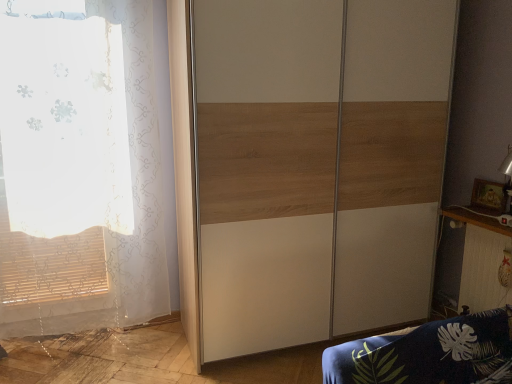
Image resolution: width=512 pixels, height=384 pixels. Describe the element at coordinates (133, 205) in the screenshot. I see `white sheer curtain at left` at that location.

Locate an element on the screen. This screenshot has width=512, height=384. white sheer curtain at left is located at coordinates (133, 205).

Which object is positioned more to the left, wooden/textured wardrobe at center or white sheer curtain at left?

white sheer curtain at left.

Is the position of wooden/textured wardrobe at center more distant than that of white sheer curtain at left?

No, wooden/textured wardrobe at center is closer to the camera.

Based on the photo, can you confirm if wooden/textured wardrobe at center is taller than white sheer curtain at left?

Indeed, wooden/textured wardrobe at center has a greater height compared to white sheer curtain at left.

From the image's perspective, is wooden/textured wardrobe at center beneath white sheer curtain at left?

Actually, wooden/textured wardrobe at center appears above white sheer curtain at left in the image.

Is wooden table at right beside wooden/textured wardrobe at center?

No, wooden table at right is not beside wooden/textured wardrobe at center.

Which object is thinner, wooden table at right or wooden/textured wardrobe at center?

wooden table at right.

Looking at this image, which object is closer to the camera taking this photo, wooden table at right or wooden/textured wardrobe at center?

wooden/textured wardrobe at center is in front.

Looking at this image, from the image's perspective, is white sheer curtain at left under wooden/textured wardrobe at center?

Yes.

Choose the correct answer: Is white sheer curtain at left inside wooden/textured wardrobe at center or outside it?

white sheer curtain at left is spatially situated outside wooden/textured wardrobe at center.

From a real-world perspective, which object rests below the other?

From a 3D spatial view, white sheer curtain at left is below.

Which is more to the right, white sheer curtain at left or wooden/textured wardrobe at center?

wooden/textured wardrobe at center is more to the right.

Can you confirm if wooden table at right is positioned to the left of white sheer curtain at left?

Incorrect, wooden table at right is not on the left side of white sheer curtain at left.

Which point is more distant from viewer, (510, 247) or (151, 140)?

The point (151, 140) is farther.

Who is smaller, wooden table at right or white sheer curtain at left?

Smaller between the two is wooden table at right.

The width and height of the screenshot is (512, 384). In the image, there is a white sheer curtain at left. In order to click on table below it (from a real-world perspective) in this screenshot , I will do `click(482, 260)`.

How different are the orientations of wooden/textured wardrobe at center and wooden table at right in degrees?

There is a 90.1-degree angle between the facing directions of wooden/textured wardrobe at center and wooden table at right.

Is wooden/textured wardrobe at center beside wooden table at right?

There is a gap between wooden/textured wardrobe at center and wooden table at right.

Considering the relative sizes of wooden/textured wardrobe at center and wooden table at right in the image provided, is wooden/textured wardrobe at center bigger than wooden table at right?

Correct, wooden/textured wardrobe at center is larger in size than wooden table at right.

From the image's perspective, between white sheer curtain at left and wooden table at right, who is located below?

From the image's view, wooden table at right is below.

Is white sheer curtain at left touching wooden table at right?

There is a gap between white sheer curtain at left and wooden table at right.

Based on the photo, is white sheer curtain at left facing towards wooden table at right?

No, white sheer curtain at left does not turn towards wooden table at right.

Find the location of `curtain below the wooden/textured wardrobe at center (from the image's perspective)`. curtain below the wooden/textured wardrobe at center (from the image's perspective) is located at coordinates (133, 205).

This screenshot has width=512, height=384. What are the coordinates of `screen door above the wooden table at right (from the image's perspective)` in the screenshot? It's located at (318, 165).

Estimate the real-world distances between objects in this image. Which object is closer to white sheer curtain at left, wooden/textured wardrobe at center or wooden table at right?

Based on the image, wooden/textured wardrobe at center appears to be nearer to white sheer curtain at left.

Looking at the image, which one is located further to wooden table at right, white sheer curtain at left or wooden/textured wardrobe at center?

white sheer curtain at left is positioned further to the anchor wooden table at right.

Consider the image. Estimate the real-world distances between objects in this image. Which object is closer to wooden table at right, wooden/textured wardrobe at center or white sheer curtain at left?

wooden/textured wardrobe at center is closer to wooden table at right.

Considering their positions, is white sheer curtain at left positioned closer to wooden/textured wardrobe at center than wooden table at right?

Among the two, wooden table at right is located nearer to wooden/textured wardrobe at center.

Considering their positions, is wooden table at right positioned closer to white sheer curtain at left than wooden/textured wardrobe at center?

wooden/textured wardrobe at center is positioned closer to the anchor white sheer curtain at left.

Considering their positions, is wooden table at right positioned closer to wooden/textured wardrobe at center than white sheer curtain at left?

wooden table at right.

At what (x,y) coordinates should I click in order to perform the action: click on screen door between white sheer curtain at left and wooden table at right. Please return your answer as a coordinate pair (x, y). The width and height of the screenshot is (512, 384). Looking at the image, I should click on (318, 165).